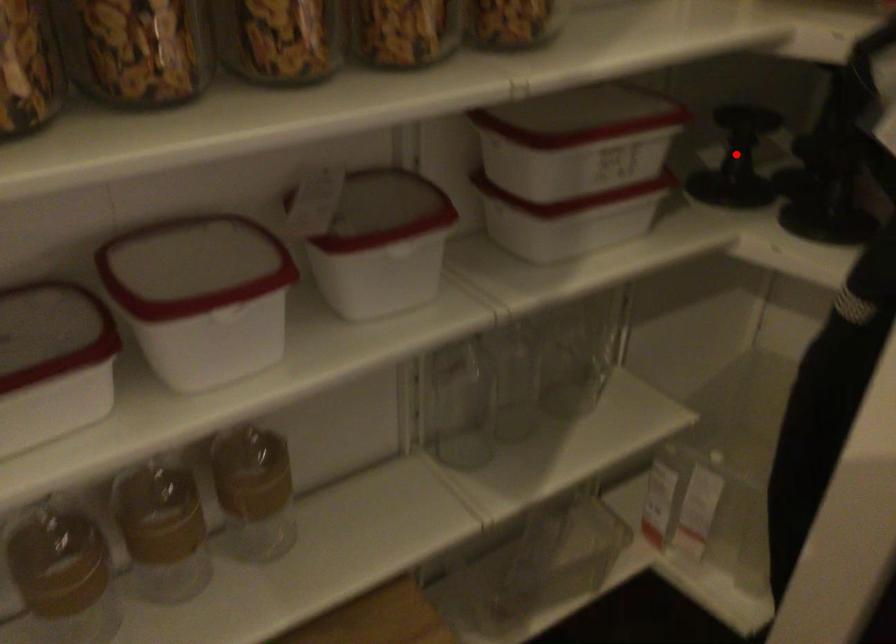
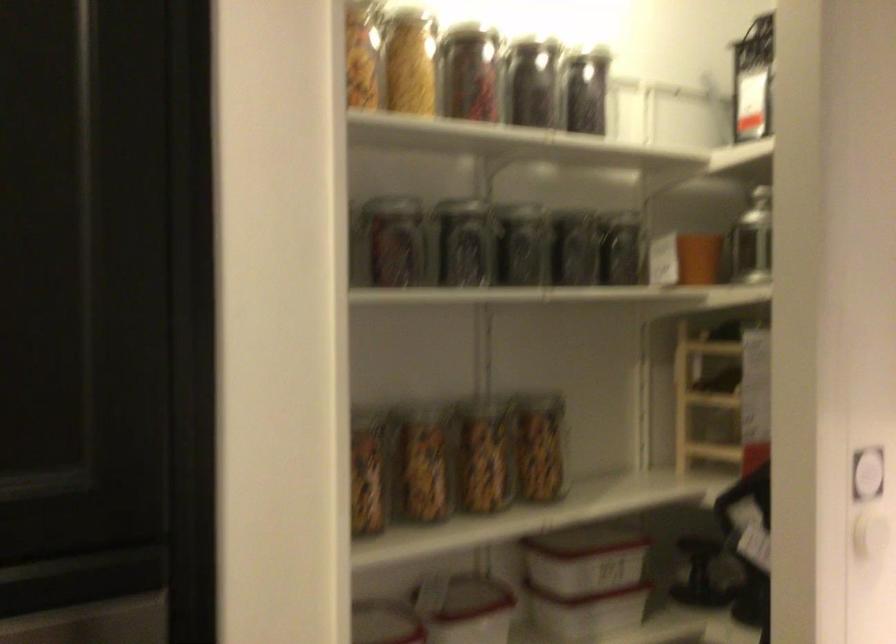
Find the pixel in the second image that matches the highlighted location in the first image.

(700, 574)